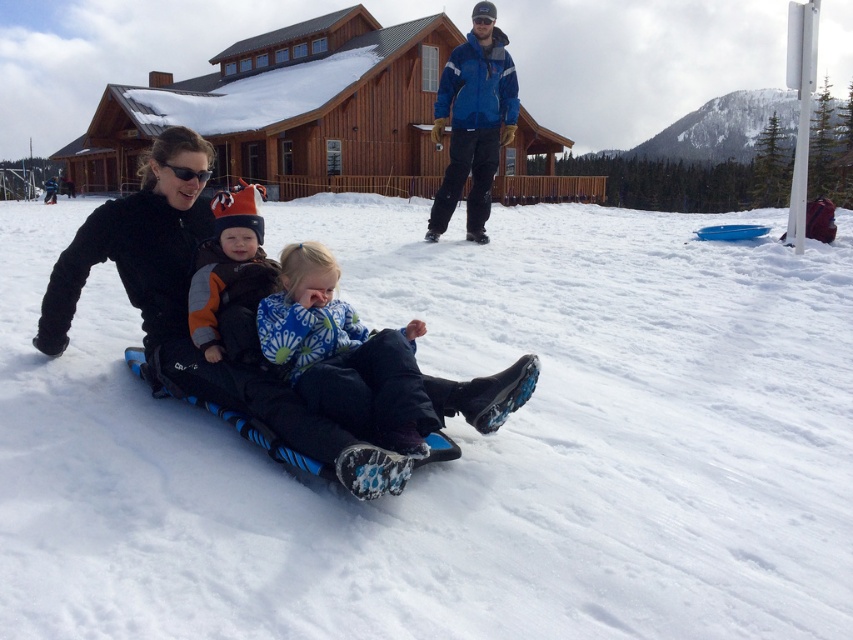
Question: In this image, where is white snow at center located relative to black matte goggles at upper left?

Choices:
 (A) above
 (B) below

Answer: (A)

Question: Which object is the farthest from the blue softshell jacket at upper center?

Choices:
 (A) blue fleece jacket at center
 (B) white snow at center

Answer: (A)

Question: In this image, where is blue fleece jacket at center located relative to black matte goggles at upper left?

Choices:
 (A) below
 (B) above

Answer: (A)

Question: Among these points, which one is farthest from the camera?

Choices:
 (A) (500, 436)
 (B) (171, 285)

Answer: (B)

Question: Can you confirm if white snow at center is positioned to the right of blue softshell jacket at upper center?

Choices:
 (A) no
 (B) yes

Answer: (A)

Question: Which point is closer to the camera?

Choices:
 (A) (15, 339)
 (B) (408, 426)

Answer: (B)